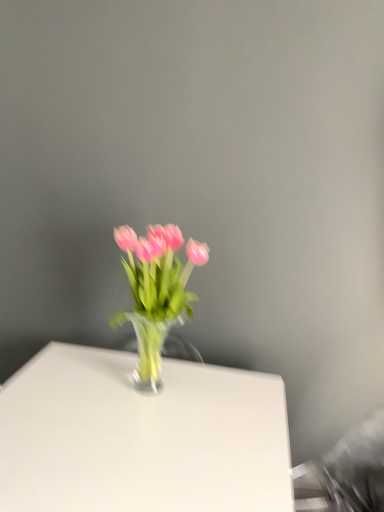
Question: Is pink glass vase at center inside or outside of white glossy table at center?

Choices:
 (A) outside
 (B) inside

Answer: (A)

Question: From the image's perspective, is pink glass vase at center above or below white glossy table at center?

Choices:
 (A) above
 (B) below

Answer: (A)

Question: Considering their positions, is pink glass vase at center located in front of or behind white glossy table at center?

Choices:
 (A) behind
 (B) front

Answer: (A)

Question: From a real-world perspective, is white glossy table at center positioned above or below pink glass vase at center?

Choices:
 (A) below
 (B) above

Answer: (A)

Question: Is white glossy table at center wider or thinner than pink glass vase at center?

Choices:
 (A) thin
 (B) wide

Answer: (B)

Question: Based on their sizes in the image, would you say white glossy table at center is bigger or smaller than pink glass vase at center?

Choices:
 (A) small
 (B) big

Answer: (B)

Question: Considering their positions, is white glossy table at center located in front of or behind pink glass vase at center?

Choices:
 (A) front
 (B) behind

Answer: (A)